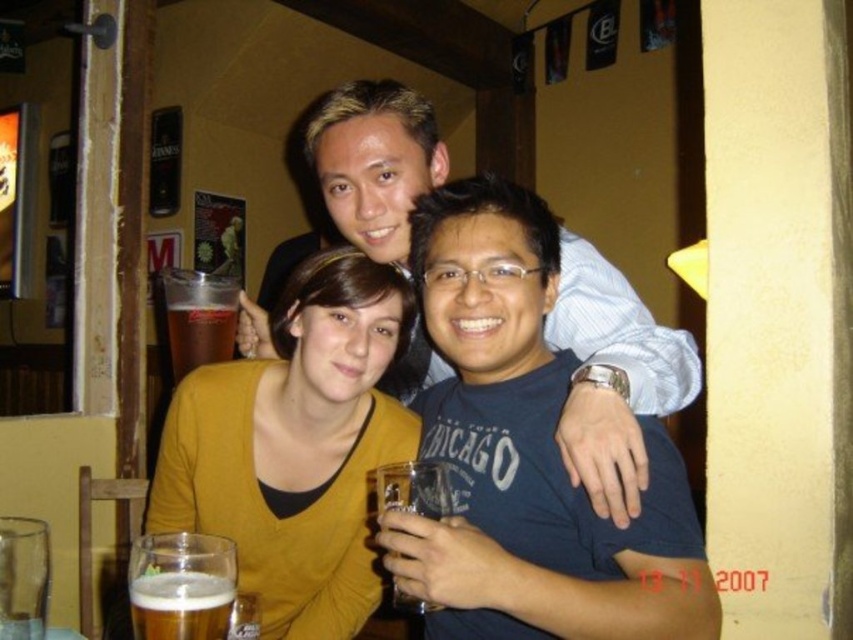
You are a bartender and need to place a new drink order. You see the yellow sweater at center and the clear glass beer at center. Which item is closer to the left side of the scene?

The yellow sweater at center is to the left of the clear glass beer at center, so it is closer to the left side of the scene.

You are a bartender in this bar and need to place a new menu stand between the yellow sweater at center and the clear glass beer at center. Which object should you place it closer to so the menu is visible to both people?

The yellow sweater at center is much taller than the clear glass beer at center, so placing the menu stand closer to the yellow sweater at center would ensure visibility for both individuals.